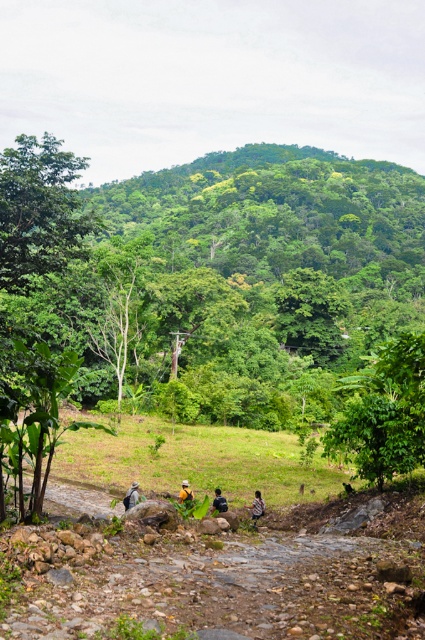
Which of these two, green leafy tree at lower right or striped shirt at lower center, stands shorter?

striped shirt at lower center

How far apart are green leafy tree at lower right and striped shirt at lower center?

11.27 meters

Where is `green leafy tree at lower right`? The image size is (425, 640). green leafy tree at lower right is located at coordinates (385, 413).

Does green leafy tree at lower right have a larger size compared to yellow fabric shirt at center?

Yes.

Is point (402, 349) positioned after point (189, 492)?

No, (402, 349) is in front of (189, 492).

Locate an element on the screen. green leafy tree at lower right is located at coordinates (385, 413).

Is striped shirt at lower center closer to the viewer compared to light brown fabric shirt at center?

No, it is behind light brown fabric shirt at center.

Is striped shirt at lower center wider than light brown fabric shirt at center?

Incorrect, striped shirt at lower center's width does not surpass light brown fabric shirt at center's.

Does point (255, 520) lie in front of point (133, 490)?

Yes, it is in front of point (133, 490).

Where is `striped shirt at lower center`? The height and width of the screenshot is (640, 425). striped shirt at lower center is located at coordinates (257, 508).